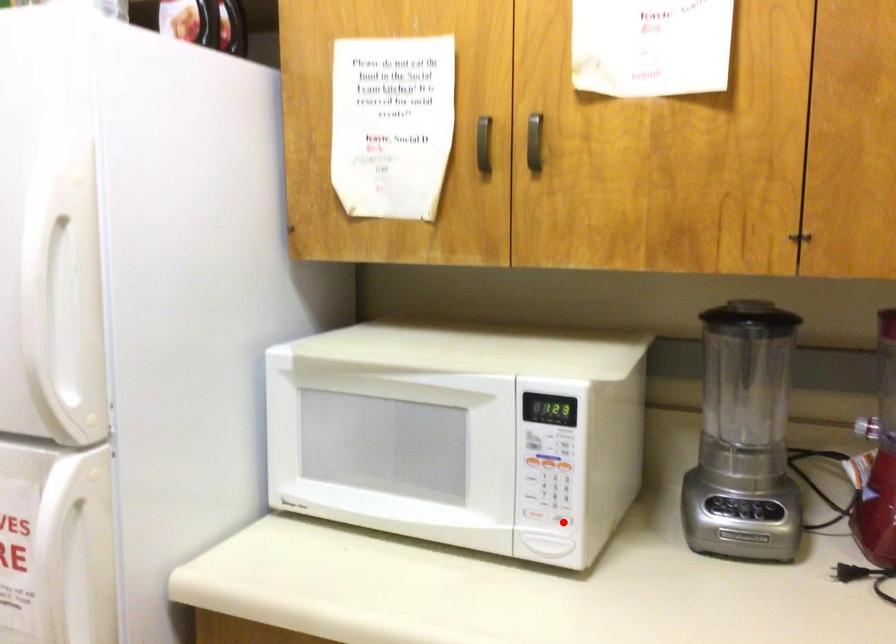
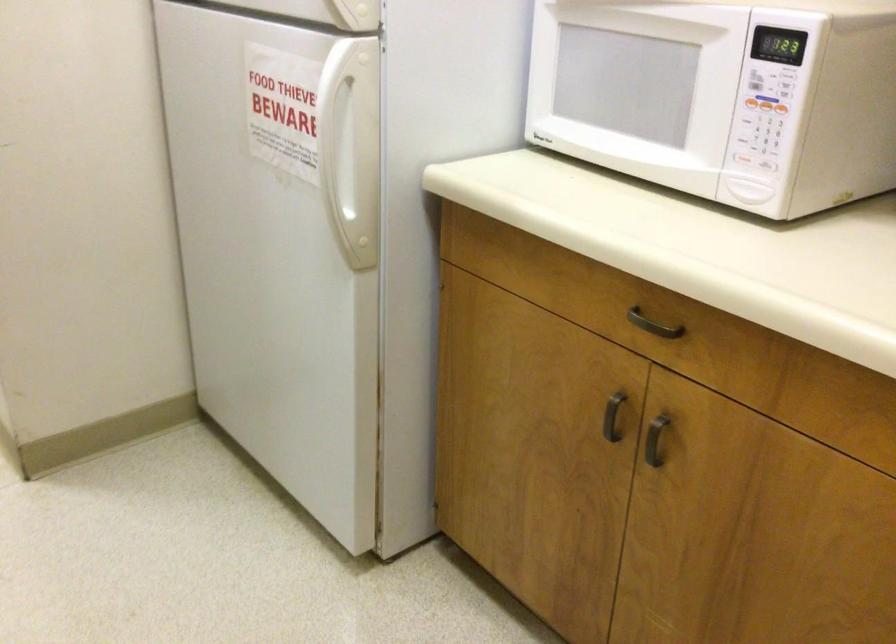
The point at the highlighted location is marked in the first image. Where is the corresponding point in the second image?

(764, 164)